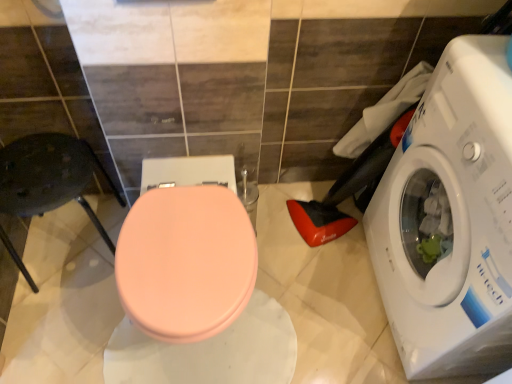
At what (x,y) coordinates should I click in order to perform the action: click on metallic dark gray chair at left. Please return your answer as a coordinate pair (x, y). The image size is (512, 384). Looking at the image, I should click on (49, 176).

What is the approximate height of white glossy washing machine at right?

white glossy washing machine at right is 33.49 inches in height.

This screenshot has width=512, height=384. Find the location of `metallic dark gray chair at left`. metallic dark gray chair at left is located at coordinates (49, 176).

Locate an element on the screen. This screenshot has height=384, width=512. washing machine lying on the right of matte pink lid at center is located at coordinates (450, 219).

Looking at their sizes, would you say white glossy washing machine at right is wider or thinner than matte pink lid at center?

Clearly, white glossy washing machine at right has less width compared to matte pink lid at center.

Is the depth of white glossy washing machine at right less than that of matte pink lid at center?

Yes, white glossy washing machine at right is in front of matte pink lid at center.

How much distance is there between white glossy washing machine at right and matte pink lid at center?

white glossy washing machine at right is 22.87 inches away from matte pink lid at center.

Where is `washing machine that is in front of the metallic dark gray chair at left`? This screenshot has width=512, height=384. washing machine that is in front of the metallic dark gray chair at left is located at coordinates (450, 219).

Would you say metallic dark gray chair at left is to the left or to the right of white glossy washing machine at right in the picture?

metallic dark gray chair at left is positioned on white glossy washing machine at right's left side.

From a real-world perspective, between metallic dark gray chair at left and white glossy washing machine at right, who is vertically higher?

white glossy washing machine at right is physically above.

Visually, is matte pink lid at center positioned to the left or to the right of metallic dark gray chair at left?

Based on their positions, matte pink lid at center is located to the right of metallic dark gray chair at left.

Is matte pink lid at center aimed at metallic dark gray chair at left?

No, matte pink lid at center is not oriented towards metallic dark gray chair at left.

Considering the sizes of matte pink lid at center and metallic dark gray chair at left in the image, is matte pink lid at center taller or shorter than metallic dark gray chair at left?

Considering their sizes, matte pink lid at center has more height than metallic dark gray chair at left.

Is matte pink lid at center spatially inside metallic dark gray chair at left, or outside of it?

matte pink lid at center cannot be found inside metallic dark gray chair at left.

Considering the sizes of matte pink lid at center and white glossy washing machine at right in the image, is matte pink lid at center bigger or smaller than white glossy washing machine at right?

Clearly, matte pink lid at center is smaller in size than white glossy washing machine at right.

Based on the photo, from the image's perspective, between matte pink lid at center and white glossy washing machine at right, which one is located above?

From the image's view, white glossy washing machine at right is above.

Based on the photo, choose the correct answer: Is matte pink lid at center inside white glossy washing machine at right or outside it?

matte pink lid at center cannot be found inside white glossy washing machine at right.

Identify the location of bidet on the left of white glossy washing machine at right. (186, 262).

Is white glossy washing machine at right directly adjacent to metallic dark gray chair at left?

No, white glossy washing machine at right is not with metallic dark gray chair at left.

From the image's perspective, is white glossy washing machine at right above or below metallic dark gray chair at left?

From the image's perspective, white glossy washing machine at right appears below metallic dark gray chair at left.

From their relative heights in the image, would you say white glossy washing machine at right is taller or shorter than metallic dark gray chair at left?

Considering their sizes, white glossy washing machine at right has more height than metallic dark gray chair at left.

Can you confirm if metallic dark gray chair at left is wider than matte pink lid at center?

No, metallic dark gray chair at left is not wider than matte pink lid at center.

Is metallic dark gray chair at left facing away from matte pink lid at center?

metallic dark gray chair at left does not have its back to matte pink lid at center.

Is metallic dark gray chair at left to the left of matte pink lid at center from the viewer's perspective?

Indeed, metallic dark gray chair at left is positioned on the left side of matte pink lid at center.

The height and width of the screenshot is (384, 512). I want to click on bidet behind the white glossy washing machine at right, so click(186, 262).

Where is `chair above the white glossy washing machine at right (from the image's perspective)`? chair above the white glossy washing machine at right (from the image's perspective) is located at coordinates (49, 176).

When comparing their distances from white glossy washing machine at right, does matte pink lid at center or metallic dark gray chair at left seem further?

Based on the image, metallic dark gray chair at left appears to be further to white glossy washing machine at right.

Considering their positions, is metallic dark gray chair at left positioned further to matte pink lid at center than white glossy washing machine at right?

Among the two, white glossy washing machine at right is located further to matte pink lid at center.

When comparing their distances from white glossy washing machine at right, does metallic dark gray chair at left or matte pink lid at center seem closer?

matte pink lid at center is positioned closer to the anchor white glossy washing machine at right.

When comparing their distances from matte pink lid at center, does white glossy washing machine at right or metallic dark gray chair at left seem further?

Based on the image, white glossy washing machine at right appears to be further to matte pink lid at center.

When comparing their distances from metallic dark gray chair at left, does matte pink lid at center or white glossy washing machine at right seem further?

white glossy washing machine at right lies further to metallic dark gray chair at left than the other object.

Based on their spatial positions, is white glossy washing machine at right or matte pink lid at center further from metallic dark gray chair at left?

Among the two, white glossy washing machine at right is located further to metallic dark gray chair at left.

The height and width of the screenshot is (384, 512). Identify the location of bidet between metallic dark gray chair at left and white glossy washing machine at right from left to right. (186, 262).